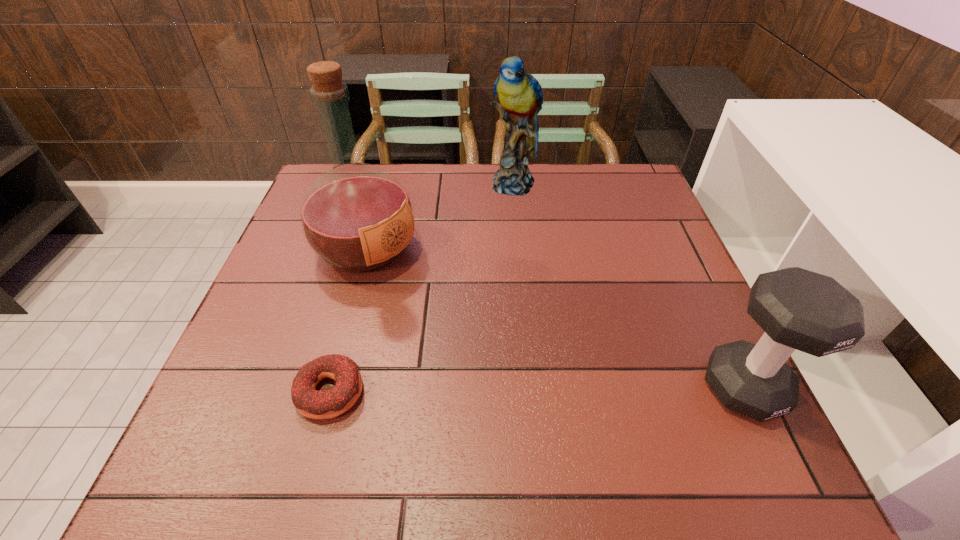
Identify the location of object located in the near left corner section of the desktop. (311, 403).

You are a GUI agent. You are given a task and a screenshot of the screen. Output one action in this format:
    pyautogui.click(x=<x>, y=<y>)
    Task: Click on the object present at the near right corner
    The height and width of the screenshot is (540, 960).
    Given the screenshot: What is the action you would take?
    pyautogui.click(x=798, y=309)

Where is `vacant area at the far edge of the desktop`? This screenshot has height=540, width=960. vacant area at the far edge of the desktop is located at coordinates (404, 184).

In the image, there is a desktop. Identify the location of vacant space at the left edge. The image size is (960, 540). (290, 241).

The height and width of the screenshot is (540, 960). In the image, there is a desktop. What are the coordinates of `free space at the far right corner` in the screenshot? It's located at (597, 183).

Find the location of a particular element. free region at the near right corner of the desktop is located at coordinates (690, 403).

This screenshot has width=960, height=540. Identify the location of free spot between the dumbbell and the second object from right to left. coord(629,286).

The image size is (960, 540). I want to click on vacant area that lies between the doughnut and the liquor, so click(x=348, y=321).

The height and width of the screenshot is (540, 960). Find the location of `vacant area that lies between the second farthest object and the second shortest object`. vacant area that lies between the second farthest object and the second shortest object is located at coordinates (556, 319).

This screenshot has height=540, width=960. Find the location of `vacant area that lies between the parrot and the third nearest object`. vacant area that lies between the parrot and the third nearest object is located at coordinates (441, 217).